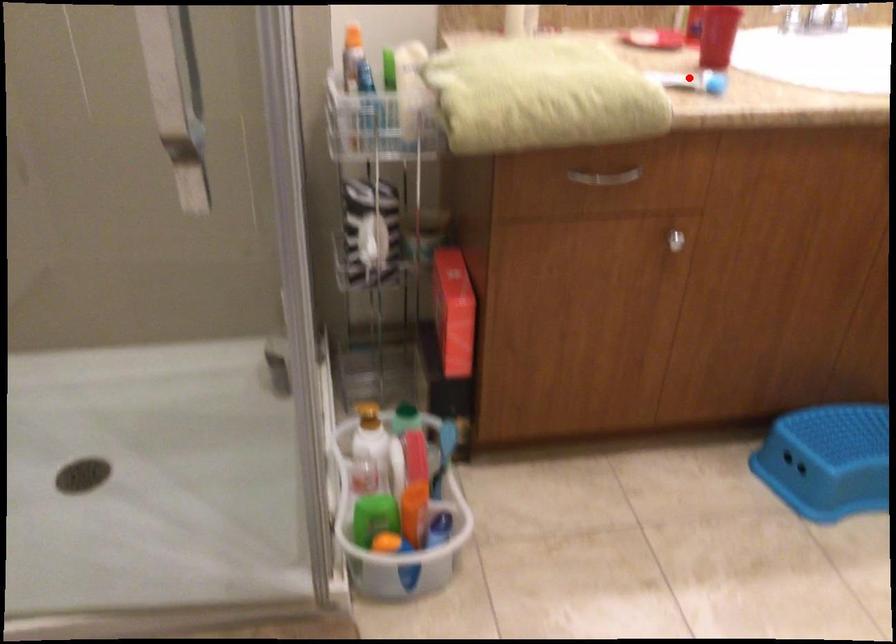
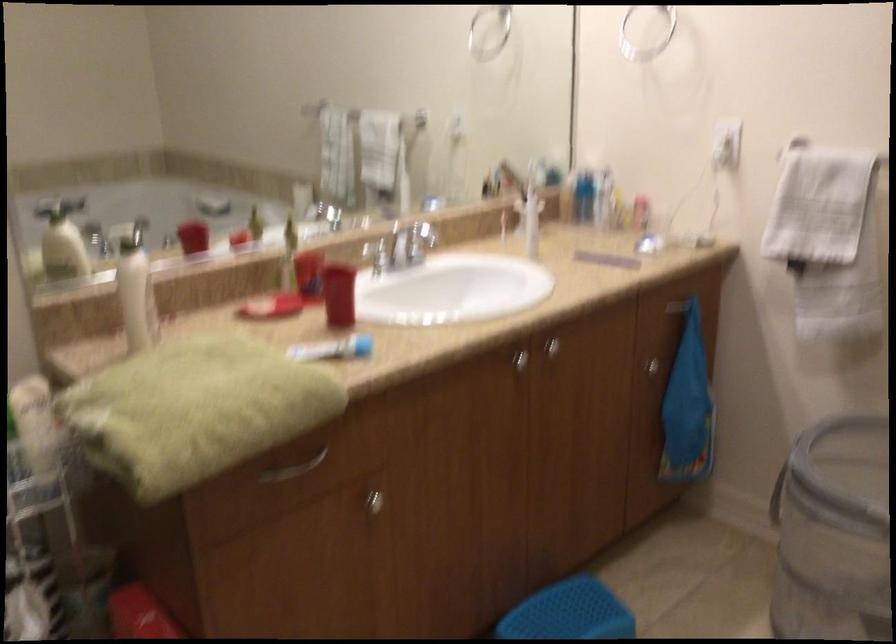
Where in the second image is the point corresponding to the highlighted location from the first image?

(332, 348)